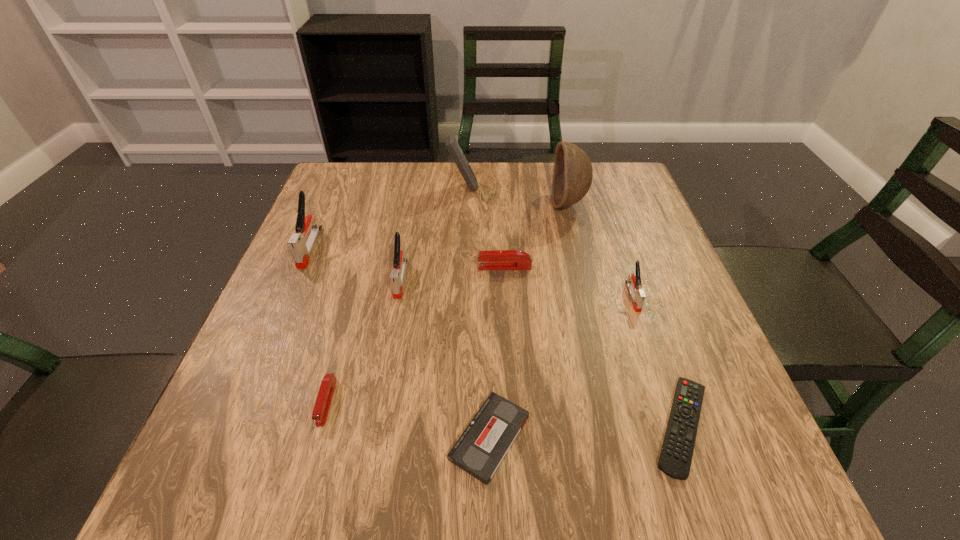
Locate an element on the screen. object that stands as the fourth closest to the biggest gray stapler is located at coordinates (497, 259).

Locate which stapler is the fifth closest to the bowl. Please provide its 2D coordinates. Your answer should be formatted as a tuple, i.e. [(x, y)], where the tuple contains the x and y coordinates of a point satisfying the conditions above.

[(320, 412)]

You are a GUI agent. You are given a task and a screenshot of the screen. Output one action in this format:
    pyautogui.click(x=<x>, y=<y>)
    Task: Click on the stapler that is the closest one to the leftmost object
    This screenshot has height=540, width=960.
    Given the screenshot: What is the action you would take?
    pyautogui.click(x=397, y=274)

The width and height of the screenshot is (960, 540). Identify the location of gray stapler object that ranks as the second closest to the leftmost gray stapler. (634, 285).

Identify which gray stapler is the third closest to the blue calculator. Please provide its 2D coordinates. Your answer should be formatted as a tuple, i.e. [(x, y)], where the tuple contains the x and y coordinates of a point satisfying the conditions above.

[(634, 285)]

Find the location of a particular element. vacant point that satisfies the following two spatial constraints: 1. on the handle side of the third stapler from right to left; 2. on the right side of the second shortest object is located at coordinates (372, 437).

Locate an element on the screen. Image resolution: width=960 pixels, height=540 pixels. free space that satisfies the following two spatial constraints: 1. on the front-facing side of the remote control; 2. on the left side of the third shortest object is located at coordinates (320, 426).

This screenshot has width=960, height=540. I want to click on free space that satisfies the following two spatial constraints: 1. on the handle side of the third object from left to right; 2. on the left side of the remote control, so click(373, 426).

Find the location of a particular element. free space that satisfies the following two spatial constraints: 1. on the front-facing side of the calculator; 2. on the right side of the bowl is located at coordinates (462, 204).

You are a GUI agent. You are given a task and a screenshot of the screen. Output one action in this format:
    pyautogui.click(x=<x>, y=<y>)
    Task: Click on the free region that satisfies the following two spatial constraints: 1. on the front-facing side of the calculator; 2. on the front-facing side of the left red stapler
    
    Given the screenshot: What is the action you would take?
    pyautogui.click(x=451, y=402)